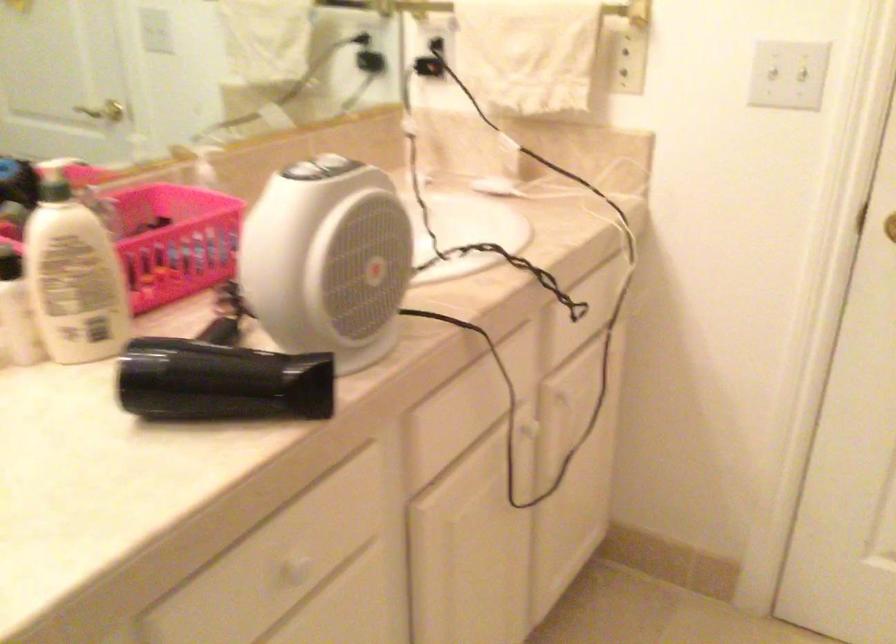
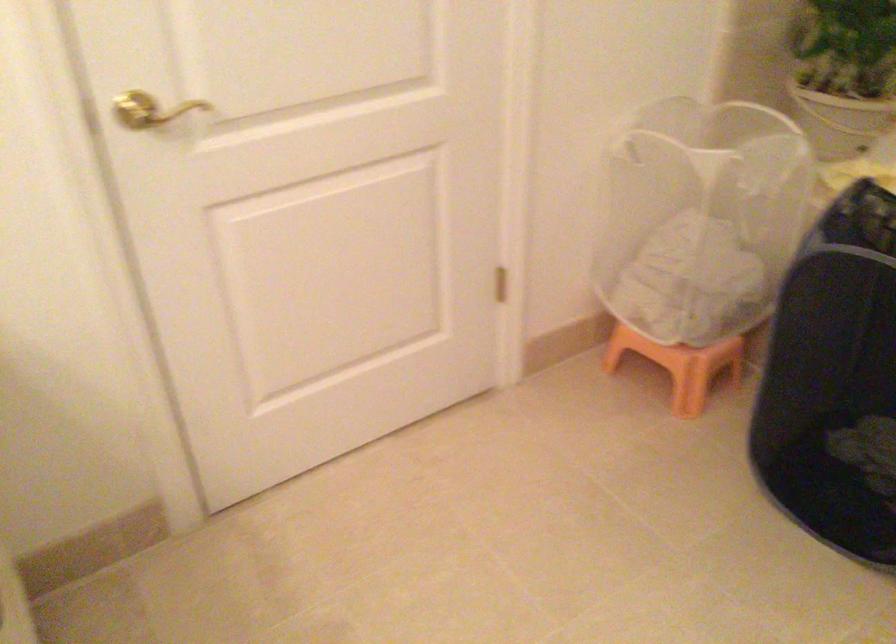
The images are taken continuously from a first-person perspective. In which direction is your viewpoint rotating?

The camera rotated toward right-down.